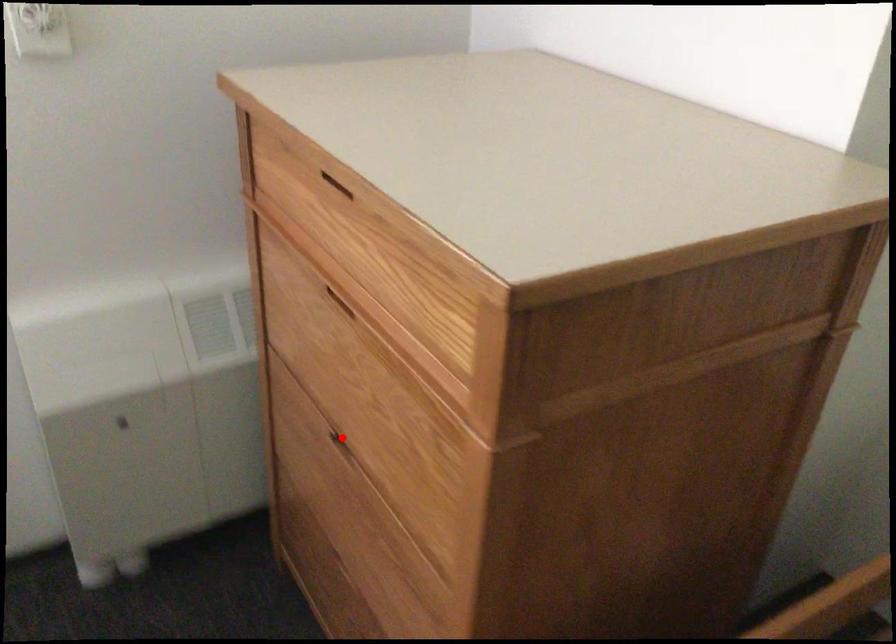
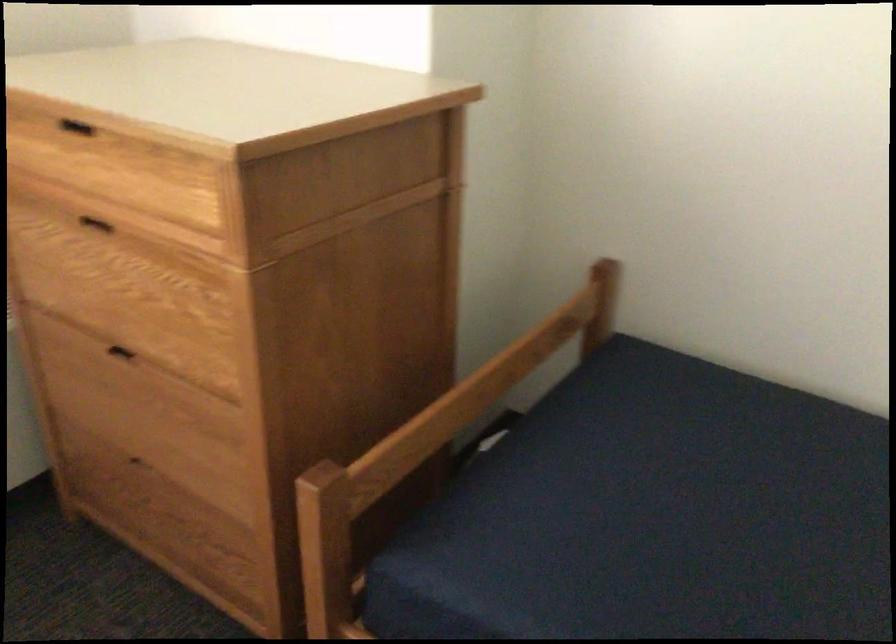
Where in the second image is the point corresponding to the highlighted location from the first image?

(119, 352)